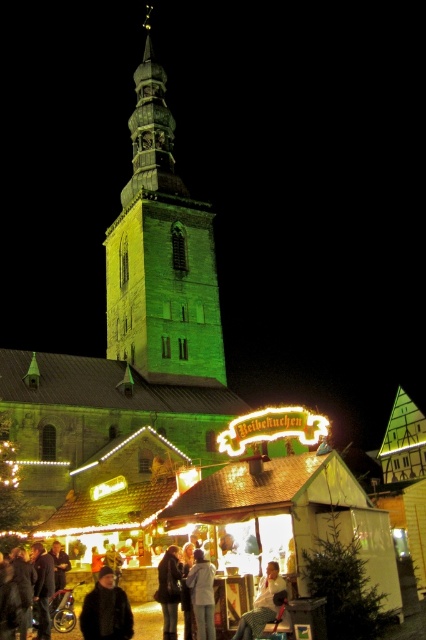
Question: Is green stone tower at center bigger than light brown leather jacket at lower center?

Choices:
 (A) no
 (B) yes

Answer: (B)

Question: Does green stone tower at center have a larger size compared to dark brown leather coat at lower left?

Choices:
 (A) no
 (B) yes

Answer: (B)

Question: Among these points, which one is nearest to the camera?

Choices:
 (A) (86, 628)
 (B) (157, 61)
 (C) (264, 611)
 (D) (206, 600)

Answer: (A)

Question: Can you confirm if dark brown leather coat at lower left is positioned above dark gray jacket at center?

Choices:
 (A) yes
 (B) no

Answer: (A)

Question: Which point is closer to the camera?

Choices:
 (A) (284, 593)
 (B) (178, 593)

Answer: (A)

Question: Which object is the closest to the light gray fabric jacket at lower center?

Choices:
 (A) light brown leather jacket at lower center
 (B) green stone tower at center

Answer: (A)